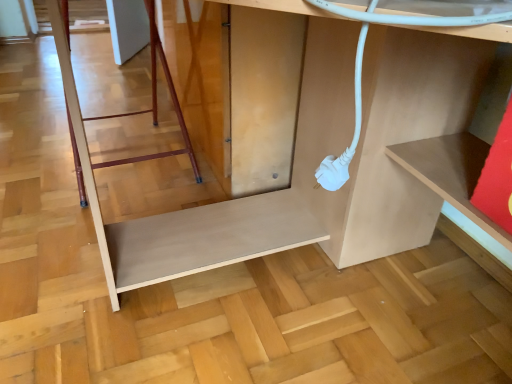
What is the approximate width of matte white cable at lower center?

It is 36.63 inches.

Describe the element at coordinates (184, 219) in the screenshot. The height and width of the screenshot is (384, 512). I see `matte white cable at lower center` at that location.

The image size is (512, 384). Identify the location of matte white cable at lower center. coord(184,219).

The image size is (512, 384). I want to click on wooden ladder at lower left, so click(156, 104).

Describe the element at coordinates (156, 104) in the screenshot. I see `wooden ladder at lower left` at that location.

Image resolution: width=512 pixels, height=384 pixels. Find the location of `matte white cable at lower center`. matte white cable at lower center is located at coordinates (184, 219).

Which is more to the right, wooden ladder at lower left or matte white cable at lower center?

matte white cable at lower center.

Relative to matte white cable at lower center, is wooden ladder at lower left in front or behind?

In the image, wooden ladder at lower left appears behind matte white cable at lower center.

Considering the points (64, 11) and (106, 261), which point is behind, point (64, 11) or point (106, 261)?

The point (106, 261) is farther from the camera.

From the image's perspective, is wooden ladder at lower left under matte white cable at lower center?

No, from the image's perspective, wooden ladder at lower left is not beneath matte white cable at lower center.

From a real-world perspective, who is located lower, wooden ladder at lower left or matte white cable at lower center?

In real-world perspective, wooden ladder at lower left is lower.

Can you confirm if wooden ladder at lower left is thinner than matte white cable at lower center?

Yes.

Considering the sizes of wooden ladder at lower left and matte white cable at lower center in the image, is wooden ladder at lower left taller or shorter than matte white cable at lower center?

In the image, wooden ladder at lower left appears to be shorter than matte white cable at lower center.

Is wooden ladder at lower left bigger than matte white cable at lower center?

No.

Does wooden ladder at lower left contain matte white cable at lower center?

No, matte white cable at lower center is not inside wooden ladder at lower left.

Is wooden ladder at lower left beside matte white cable at lower center?

No, wooden ladder at lower left is not with matte white cable at lower center.

Is wooden ladder at lower left positioned with its back to matte white cable at lower center?

No, matte white cable at lower center is not at the back of wooden ladder at lower left.

What's the angular difference between wooden ladder at lower left and matte white cable at lower center's facing directions?

The facing directions of wooden ladder at lower left and matte white cable at lower center are 3.15 degrees apart.

What are the coordinates of `ladder below the matte white cable at lower center (from a real-world perspective)` in the screenshot? It's located at (156, 104).

Between matte white cable at lower center and wooden ladder at lower left, which one appears on the right side from the viewer's perspective?

From the viewer's perspective, matte white cable at lower center appears more on the right side.

Is the depth of matte white cable at lower center greater than that of wooden ladder at lower left?

No, the depth of matte white cable at lower center is less than that of wooden ladder at lower left.

Which is behind, point (295, 209) or point (161, 156)?

Point (161, 156)

From the image's perspective, which one is positioned higher, matte white cable at lower center or wooden ladder at lower left?

wooden ladder at lower left.

From a real-world perspective, does matte white cable at lower center stand above wooden ladder at lower left?

Yes, from a real-world perspective, matte white cable at lower center is over wooden ladder at lower left

Can you confirm if matte white cable at lower center is wider than wooden ladder at lower left?

Yes.

Is matte white cable at lower center taller than wooden ladder at lower left?

Indeed, matte white cable at lower center has a greater height compared to wooden ladder at lower left.

Does matte white cable at lower center have a smaller size compared to wooden ladder at lower left?

No, matte white cable at lower center is not smaller than wooden ladder at lower left.

Would you say matte white cable at lower center is inside or outside wooden ladder at lower left?

The correct answer is: outside.

Can you see matte white cable at lower center touching wooden ladder at lower left?

No.

Is matte white cable at lower center facing towards wooden ladder at lower left?

No, matte white cable at lower center is not turned towards wooden ladder at lower left.

I want to click on furniture above the wooden ladder at lower left (from a real-world perspective), so click(184, 219).

This screenshot has height=384, width=512. I want to click on ladder below the matte white cable at lower center (from a real-world perspective), so click(156, 104).

Identify the location of ladder lying on the left of matte white cable at lower center. The image size is (512, 384). (156, 104).